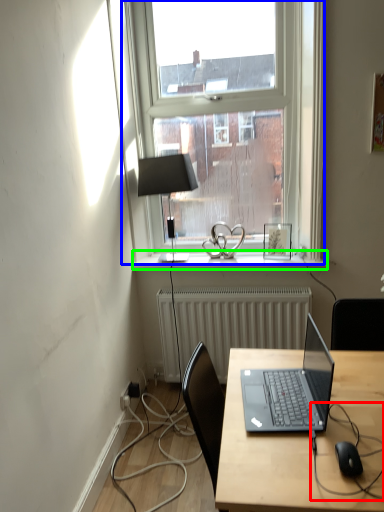
Question: Considering the real-world distances, which object is closest to cable (highlighted by a red box)? window (highlighted by a blue box) or window sill (highlighted by a green box).

Choices:
 (A) window
 (B) window sill

Answer: (B)